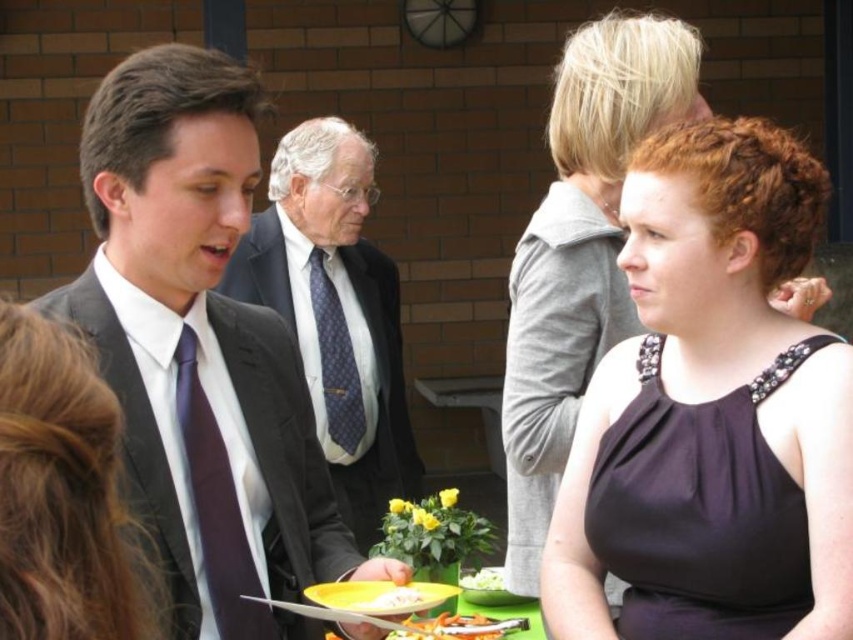
You are a guest at this event and want to place both the yellow matte platter at center and the smooth orange carrot at lower center on a shelf. The shelf has limited space. Which object should you place first to ensure both fit?

The yellow matte platter at center is smaller than the smooth orange carrot at lower center. Therefore, you should place the smooth orange carrot at lower center first, as it takes up more space, ensuring both can fit on the shelf.

You are at the coordinates point (201,349) in the image. What object is located at this point?

The object at point (201,349) is the matte black suit at left.